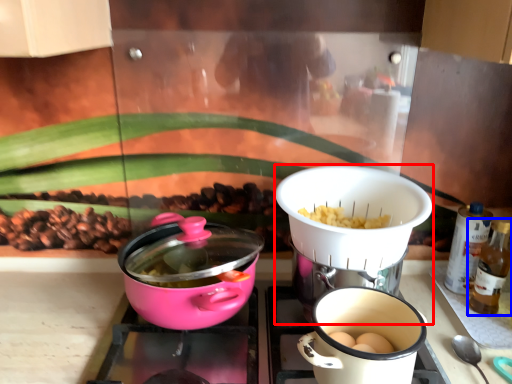
Question: Which object is further to the camera taking this photo, kitchen appliance (highlighted by a red box) or bottle (highlighted by a blue box)?

Choices:
 (A) kitchen appliance
 (B) bottle

Answer: (B)